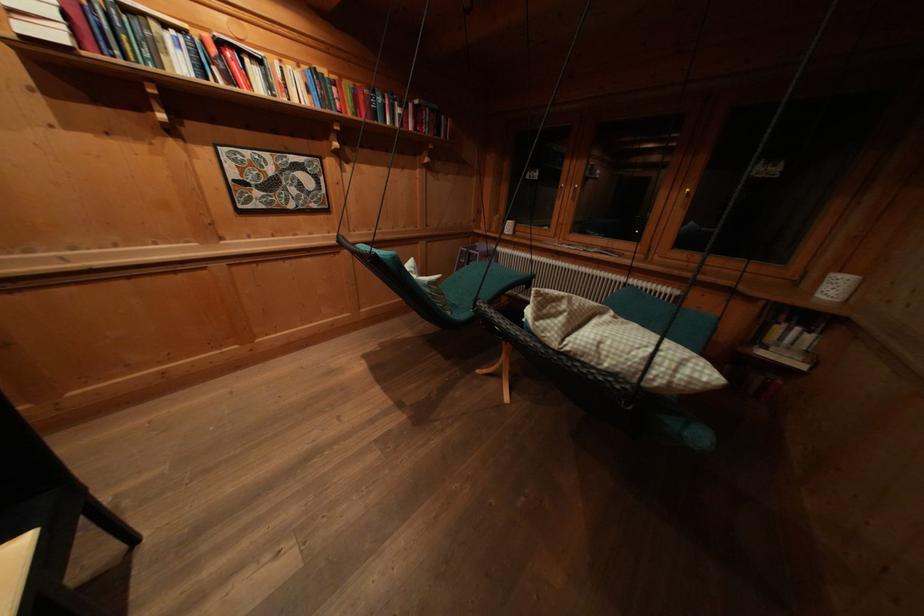
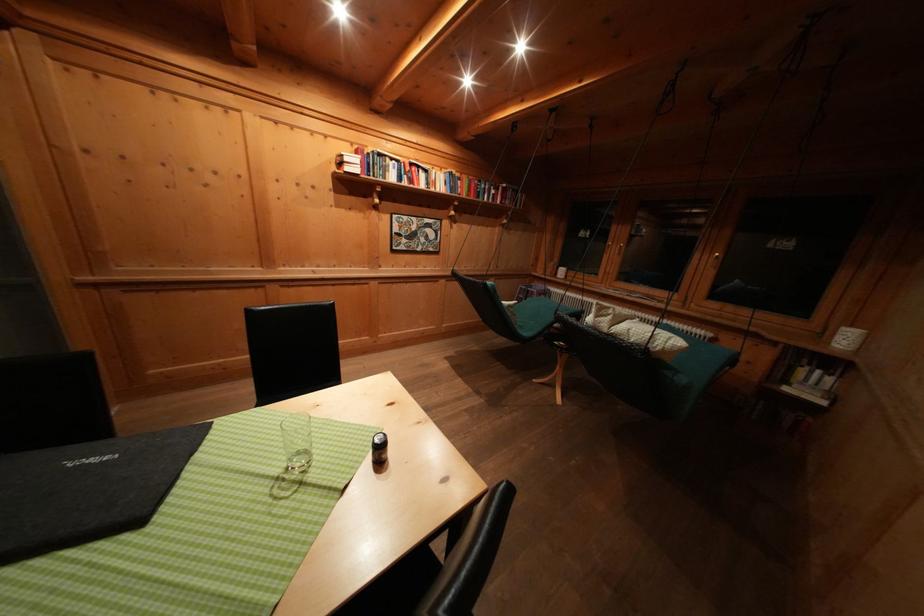
Locate, in the second image, the point that corresponds to point 444,285 in the first image.

(520, 309)